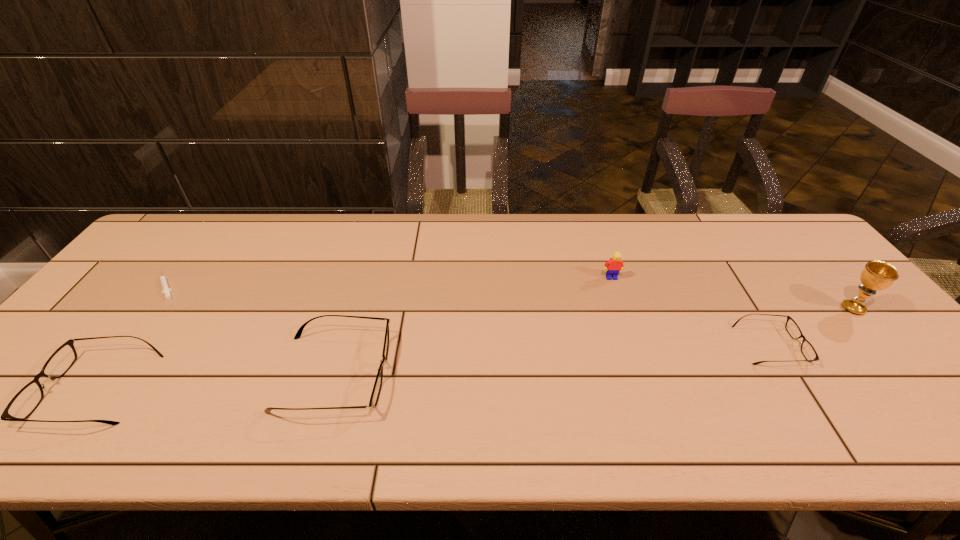
The width and height of the screenshot is (960, 540). In order to click on the second shortest spectacles in this screenshot , I will do `click(23, 404)`.

Find the location of a particular element. The width and height of the screenshot is (960, 540). the leftmost spectacles is located at coordinates pyautogui.click(x=23, y=404).

Find the location of a particular element. the second spectacles from right to left is located at coordinates (374, 398).

Identify the location of the rightmost spectacles. The image size is (960, 540). (808, 351).

Image resolution: width=960 pixels, height=540 pixels. Find the location of `the shortest spectacles`. the shortest spectacles is located at coordinates pos(808,351).

Find the location of `Lego`. Lego is located at coordinates (615, 264).

Find the location of `the fifth shortest object`. the fifth shortest object is located at coordinates (615, 264).

At what (x,y) coordinates should I click in order to perform the action: click on the shortest object. Please return your answer as a coordinate pair (x, y). This screenshot has height=540, width=960. Looking at the image, I should click on (166, 290).

Where is `the rightmost object`? The image size is (960, 540). the rightmost object is located at coordinates (877, 275).

Locate an element on the screen. chalice is located at coordinates (877, 275).